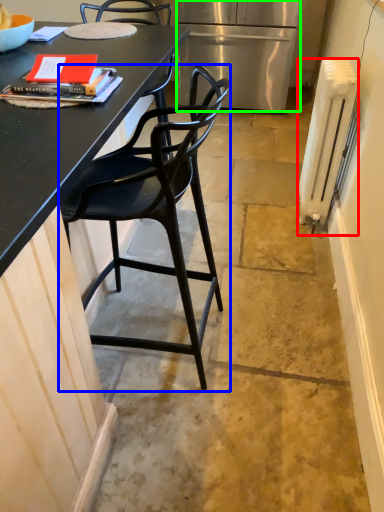
Question: Considering the real-world distances, which object is closest to radiator (highlighted by a red box)? chair (highlighted by a blue box) or refrigerator (highlighted by a green box).

Choices:
 (A) chair
 (B) refrigerator

Answer: (A)